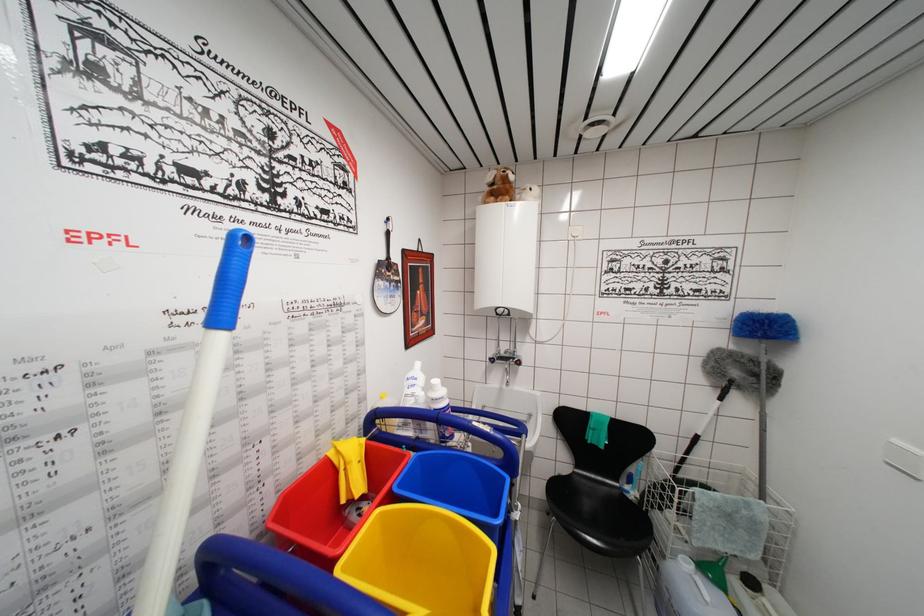
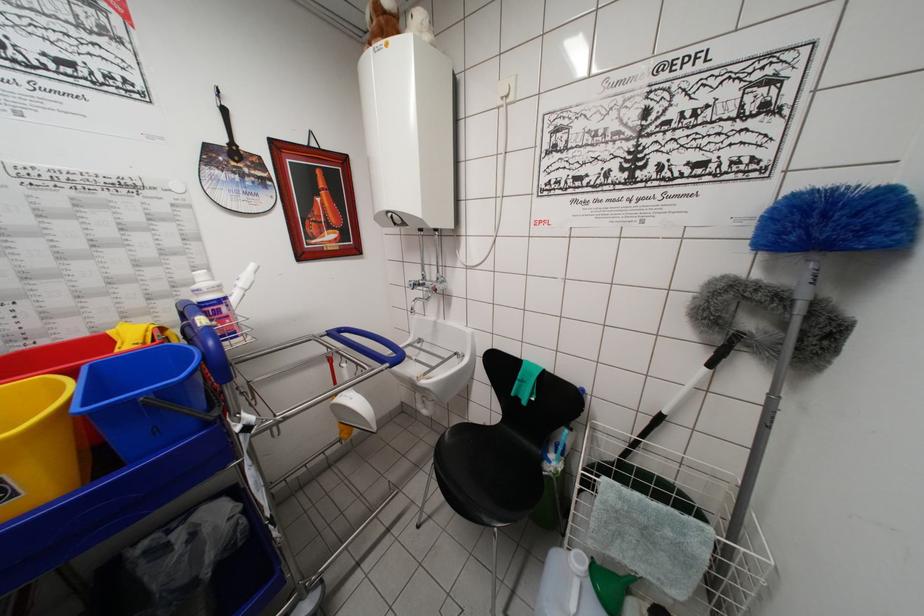
In the second image, find the point that corresponds to the point at 695,442 in the first image.

(658, 419)